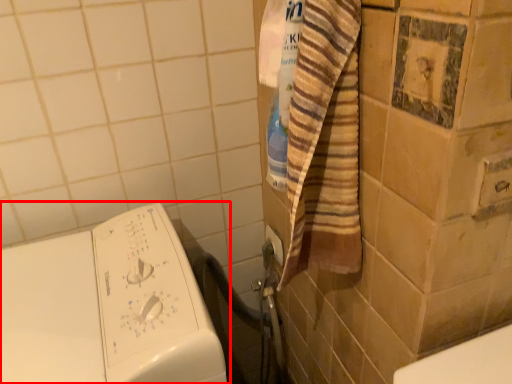
Question: In this image, where is washing machine (annotated by the red box) located relative to electric outlet?

Choices:
 (A) right
 (B) left

Answer: (B)